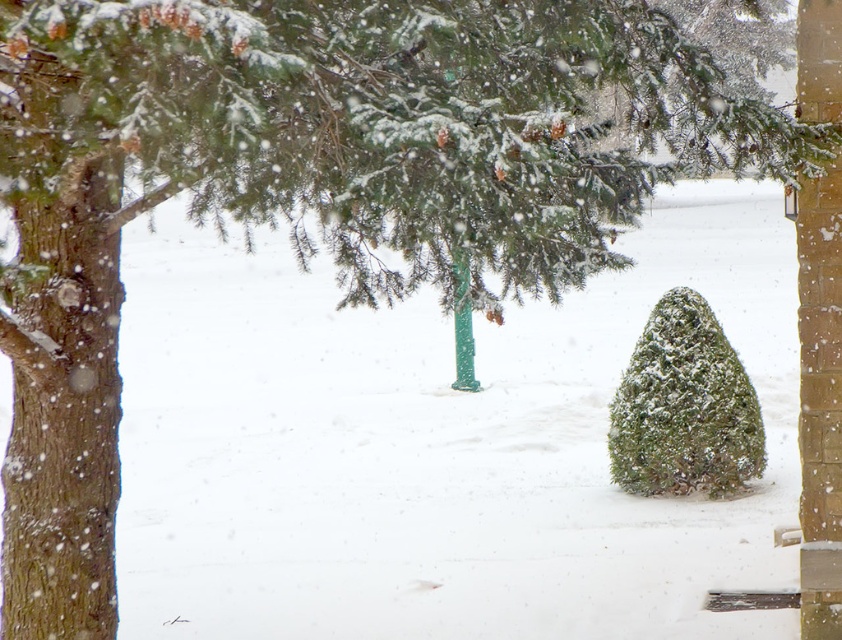
You are an observer standing in the winter scene. You see the green textured fir tree at center and the green plastic pole at center. Which object is closer to you?

The green textured fir tree at center is closer to you than the green plastic pole at center.

You are a bird looking for a place to perch. You see the green textured fir tree at center and the green plastic pole at center. Which one is taller and would provide a higher vantage point?

→ The green textured fir tree at center is much taller than the green plastic pole at center, so it would provide a higher vantage point.

You are standing at point (685, 406) in the winter scene. Which object is directly in front of you?

The green textured fir tree at center is directly in front of you at point (685, 406).